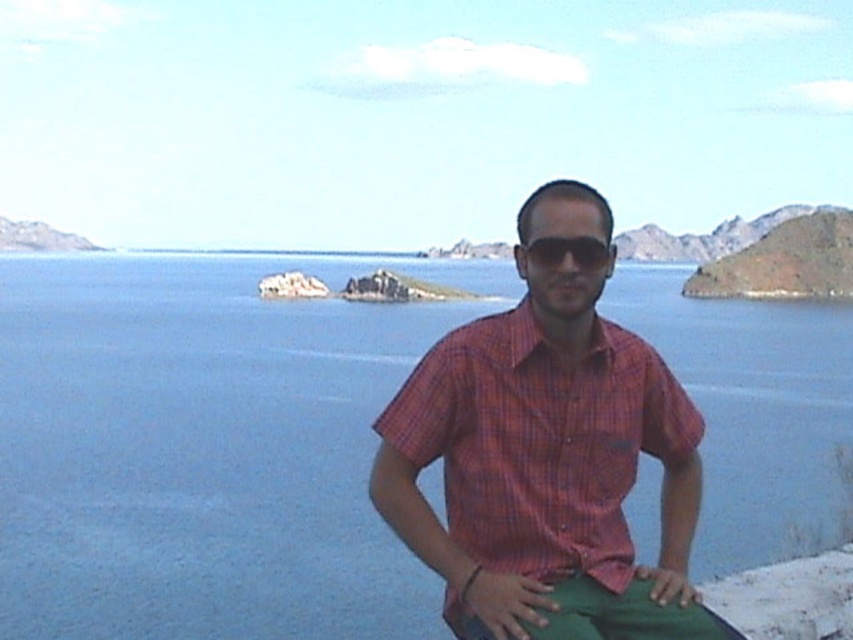
You are a photographer planning to take a portrait of the person in the scene. Since the blue water at center and the black matte sunglasses at center are both at the center, which object is closer to the photographer?

The black matte sunglasses at center are closer to the photographer because the blue water at center is positioned over them, indicating the sunglasses are in front.